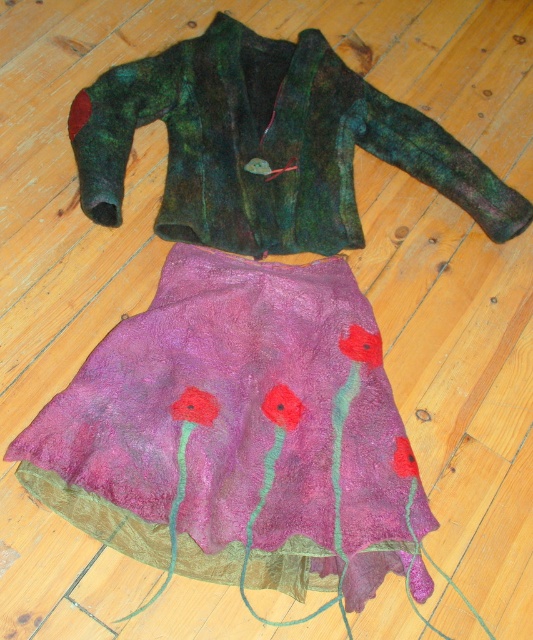
Does fluffy felt flower at center lie behind vibrant red felt flower at center?

That is False.

Between point (214, 412) and point (265, 404), which one is positioned in front?

Point (214, 412) is in front.

Find the location of a particular element. This screenshot has width=533, height=640. fluffy felt flower at center is located at coordinates (195, 406).

Between fluffy felt flower at center and matte felt flower at center, which one has more height?

With more height is matte felt flower at center.

Is point (205, 422) farther from camera compared to point (394, 467)?

Yes.

Is point (172, 413) more distant than point (415, 464)?

No, it is in front of (415, 464).

You are a GUI agent. You are given a task and a screenshot of the screen. Output one action in this format:
    pyautogui.click(x=<x>, y=<y>)
    Task: Click on the fluffy felt flower at center
    
    Given the screenshot: What is the action you would take?
    pyautogui.click(x=195, y=406)

Does purple felt skirt at center have a lesser height compared to fluffy felt flower at center?

In fact, purple felt skirt at center may be taller than fluffy felt flower at center.

Does purple felt skirt at center appear over fluffy felt flower at center?

Actually, purple felt skirt at center is below fluffy felt flower at center.

Between point (333, 336) and point (193, 412), which one is positioned behind?

The point (333, 336) is behind.

This screenshot has height=640, width=533. I want to click on purple felt skirt at center, so click(231, 432).